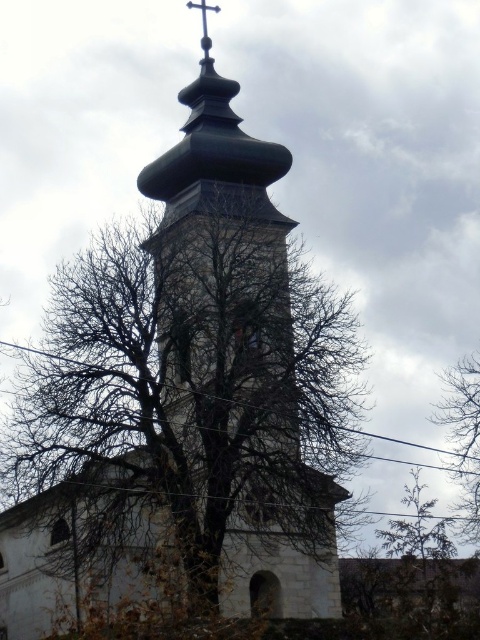
Is point (444, 528) positioned after point (192, 4)?

No.

At what (x,y) coordinates should I click in order to perform the action: click on green textured tree at center. Please return your answer as a coordinate pair (x, y). Looking at the image, I should click on (417, 529).

Where is `green textured tree at center`? The height and width of the screenshot is (640, 480). green textured tree at center is located at coordinates (417, 529).

Does point (63, 496) lie behind point (223, 381)?

Yes, point (63, 496) is behind point (223, 381).

Between bare branches at center and green stone tower at center, which one appears on the right side from the viewer's perspective?

green stone tower at center is more to the right.

In order to click on bare branches at center in this screenshot , I will do `click(180, 426)`.

Who is shorter, green stone tower at center or metallic cross at upper center?

metallic cross at upper center is shorter.

The height and width of the screenshot is (640, 480). What do you see at coordinates (238, 362) in the screenshot?
I see `green stone tower at center` at bounding box center [238, 362].

Which is in front, point (238, 476) or point (203, 3)?

Point (238, 476) is more forward.

Identify the location of green stone tower at center. (238, 362).